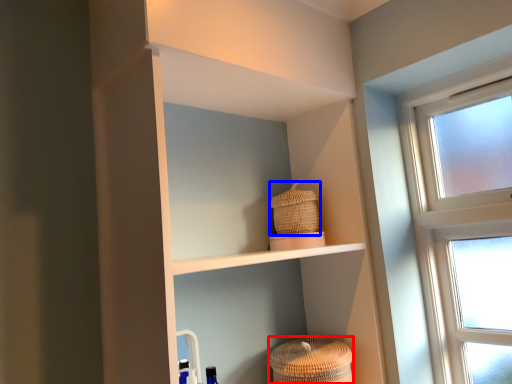
Question: Which of the following is the closest to the observer, basket (highlighted by a red box) or basket (highlighted by a blue box)?

Choices:
 (A) basket
 (B) basket

Answer: (A)